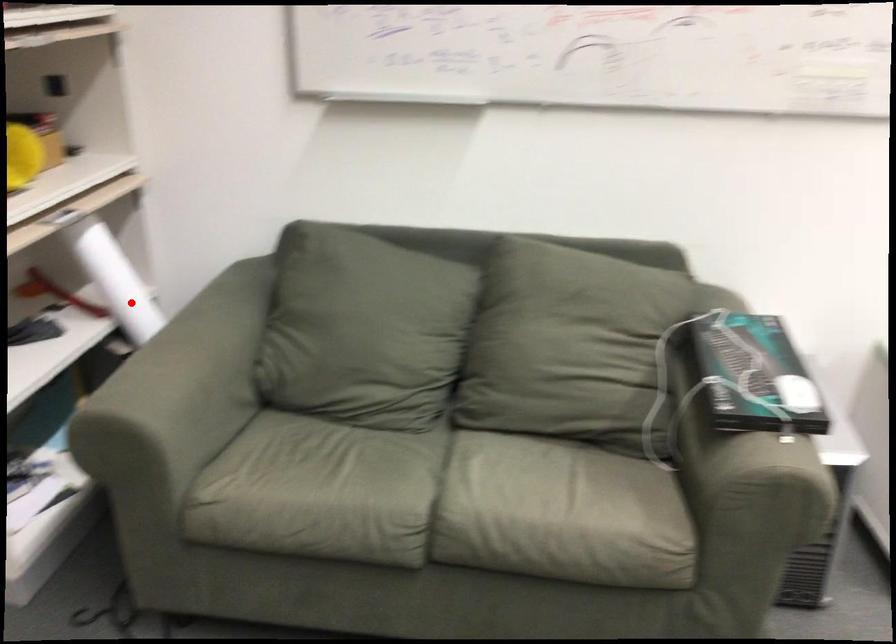
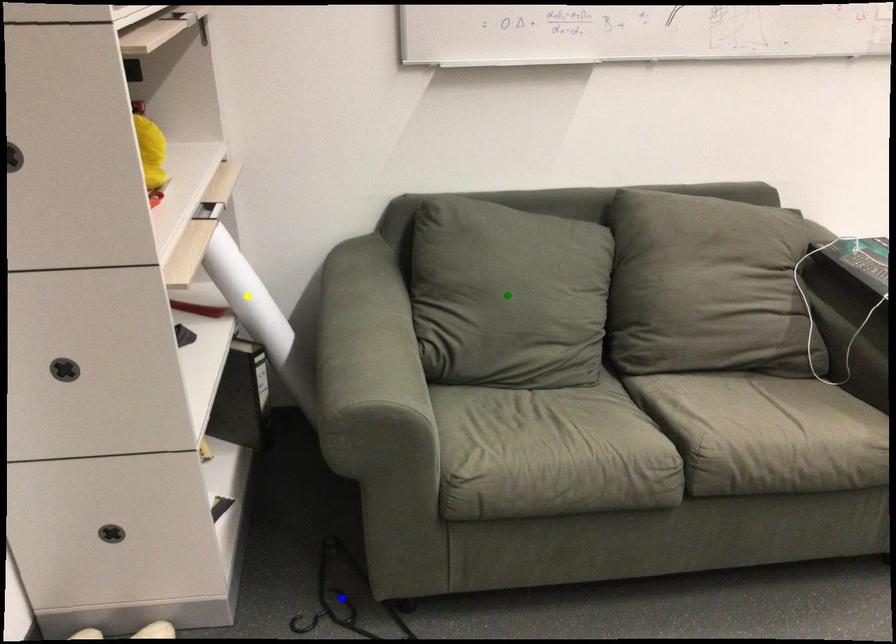
Question: I am providing you with two images of the same scene from different viewpoints. A red point is marked on the first image. You are given multiple points on the second image. Can you choose the point in image 2 that corresponds to the point in image 1?

Choices:
 (A) green point
 (B) yellow point
 (C) blue point

Answer: (B)